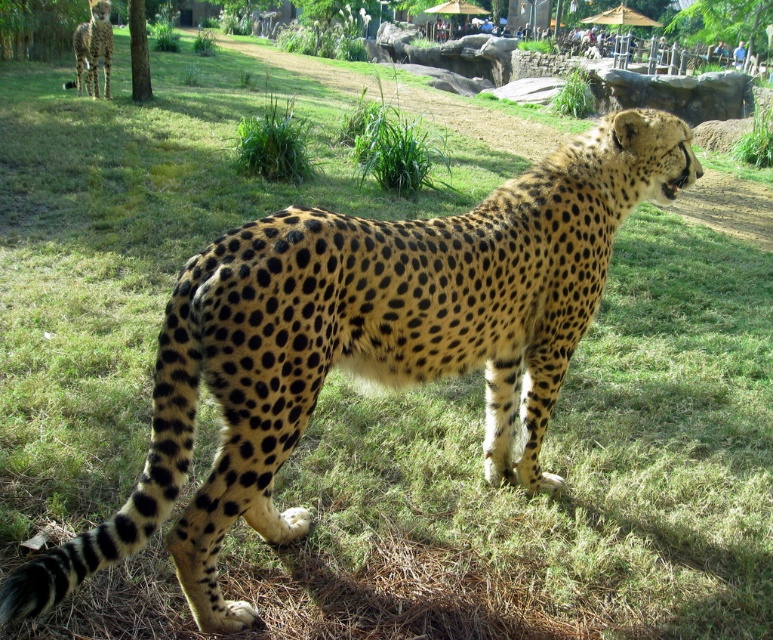
Who is more distant from viewer, (680, 10) or (142, 99)?

The point (680, 10) is more distant.

Where is `green leafy tree at upper center`? green leafy tree at upper center is located at coordinates (722, 20).

Locate an element on the screen. green leafy tree at upper center is located at coordinates (722, 20).

Can you confirm if spotted fur cheetah at upper left is bigger than green leafy tree at upper left?

Yes, spotted fur cheetah at upper left is bigger than green leafy tree at upper left.

Can you confirm if spotted fur cheetah at upper left is positioned to the left of green leafy tree at upper left?

Yes, spotted fur cheetah at upper left is to the left of green leafy tree at upper left.

What are the coordinates of `spotted fur cheetah at upper left` in the screenshot? It's located at (94, 48).

What do you see at coordinates (722, 20) in the screenshot? The height and width of the screenshot is (640, 773). I see `green leafy tree at upper center` at bounding box center [722, 20].

Does green leafy tree at upper center have a lesser height compared to spotted fur cheetah at upper left?

No, green leafy tree at upper center is not shorter than spotted fur cheetah at upper left.

Who is more forward, (765, 16) or (104, 67)?

Point (104, 67) is in front.

In order to click on green leafy tree at upper center in this screenshot , I will do `click(722, 20)`.